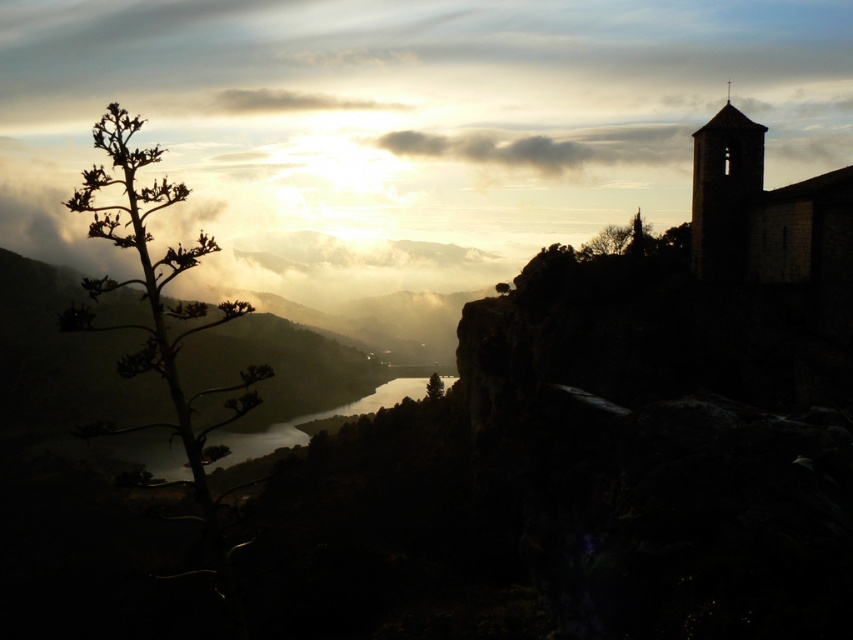
In the scene shown: You are an astronomer analyzing this landscape image. You notice a point at coordinates (154,292). What object is located at this point?

The silhouette leafy tree at left is located at point (154,292).

You are an astronomer analyzing the image. The sun is at the horizon. Where is the white fluffy cloud at upper center located relative to the sun?

The white fluffy cloud at upper center is located at point (283, 102) relative to the sun.

You are an artist planning to paint this landscape. You want to ensure the glossy reflective water at center and the green leafy tree at center are proportionally accurate. Which object should be drawn taller in your painting?

The glossy reflective water at center should be drawn taller than the green leafy tree at center according to the scene description.